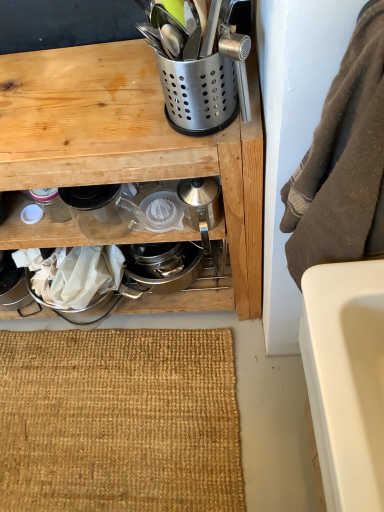
At what (x,y) coordinates should I click in order to perform the action: click on free space above burlap mat at lower center (from a real-world perspective). Please return your answer as a coordinate pair (x, y). The width and height of the screenshot is (384, 512). Looking at the image, I should click on (109, 410).